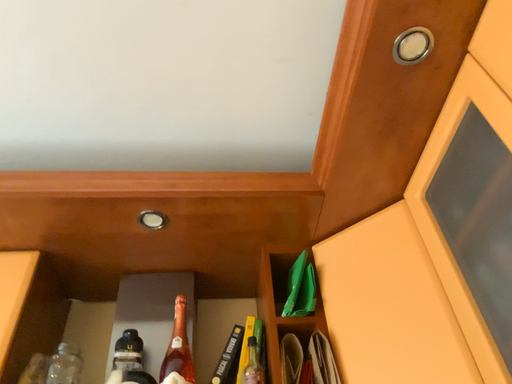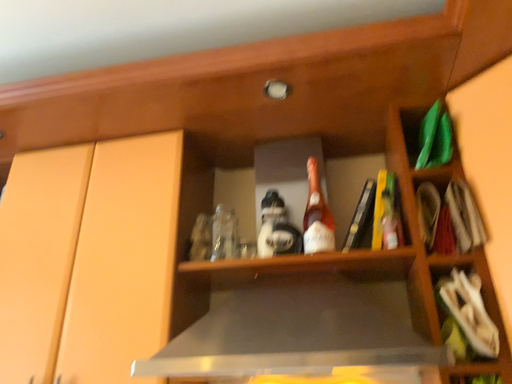
Question: How did the camera likely rotate when shooting the video?

Choices:
 (A) rotated right
 (B) rotated left

Answer: (B)